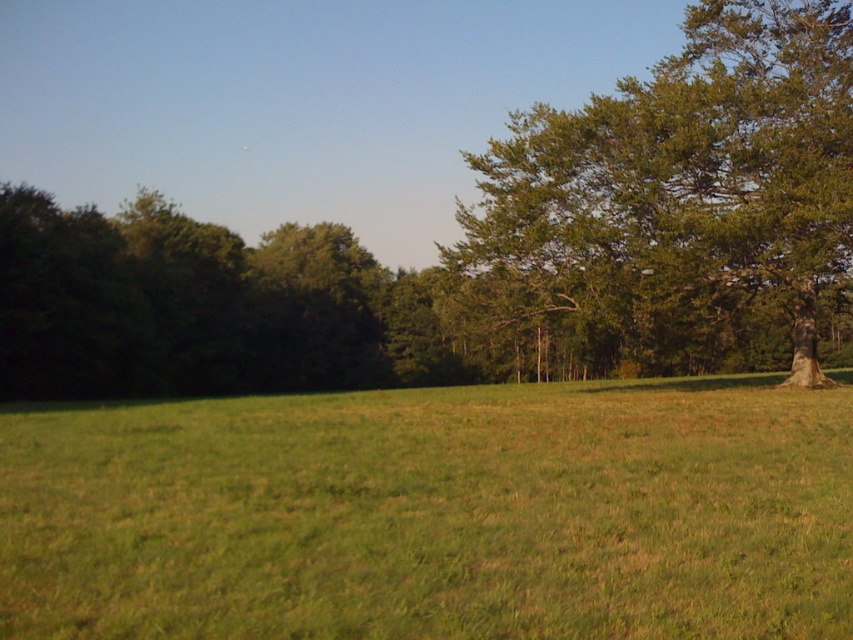
Who is taller, green grass at center or green leafy tree at right?

Standing taller between the two is green leafy tree at right.

Is point (614, 506) behind point (848, 29)?

That is False.

Describe the element at coordinates (434, 515) in the screenshot. The height and width of the screenshot is (640, 853). I see `green grass at center` at that location.

Find the location of a particular element. This screenshot has height=640, width=853. green grass at center is located at coordinates (434, 515).